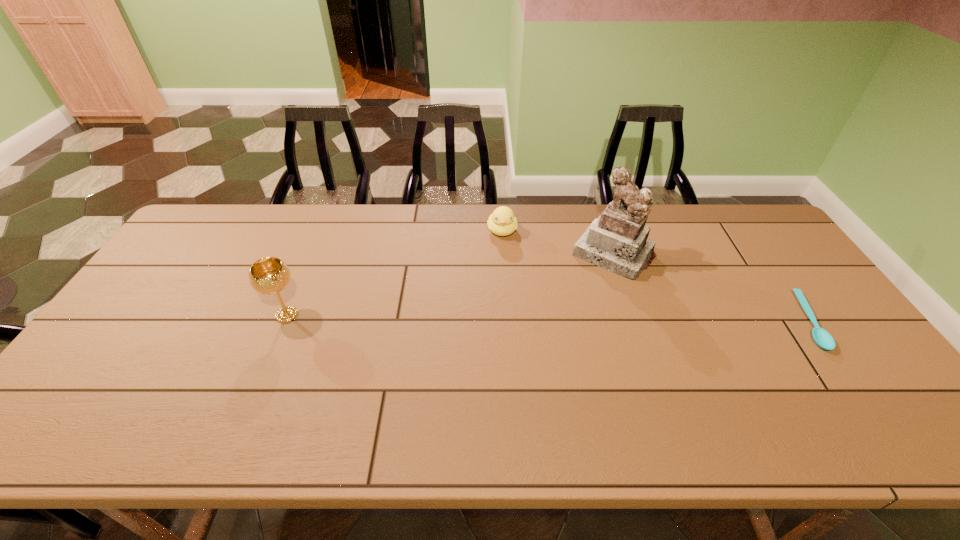
Identify the location of vacant space located on the front-facing side of the tallest object. (539, 346).

You are a GUI agent. You are given a task and a screenshot of the screen. Output one action in this format:
    pyautogui.click(x=<x>, y=<y>)
    Task: Click on the vacant space located 0.230m on the front-facing side of the tallest object
    
    Given the screenshot: What is the action you would take?
    pyautogui.click(x=558, y=322)

Identify the location of vacant position located 0.070m on the front-facing side of the tallest object. (585, 288).

At what (x,y) coordinates should I click in order to perform the action: click on vacant space located at the beak of the second object from left to right. Please return your answer as a coordinate pair (x, y). The height and width of the screenshot is (540, 960). Looking at the image, I should click on (511, 305).

Image resolution: width=960 pixels, height=540 pixels. I want to click on vacant space located at the beak of the second object from left to right, so click(514, 327).

The height and width of the screenshot is (540, 960). I want to click on vacant space located 0.230m at the beak of the second object from left to right, so click(509, 293).

The width and height of the screenshot is (960, 540). In order to click on figurine present at the far edge in this screenshot , I will do `click(617, 241)`.

Locate an element on the screen. The height and width of the screenshot is (540, 960). duckling situated at the far edge is located at coordinates (501, 222).

Where is `object situated at the right edge`? object situated at the right edge is located at coordinates (823, 339).

Locate an element on the screen. free space at the far edge of the desktop is located at coordinates (409, 235).